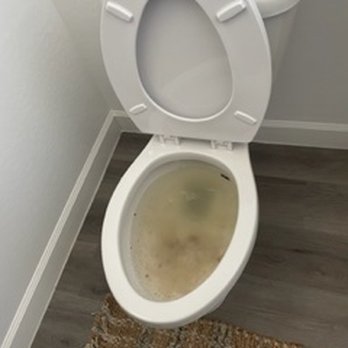
This screenshot has width=348, height=348. In order to click on one toilet in this screenshot , I will do `click(189, 193)`.